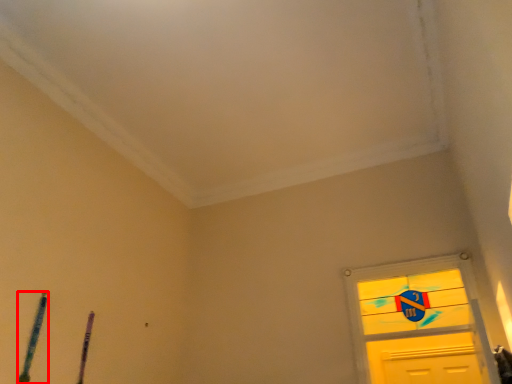
Question: From the image's perspective, what is the correct spatial positioning of twin (annotated by the red box) in reference to twin?

Choices:
 (A) below
 (B) above

Answer: (B)